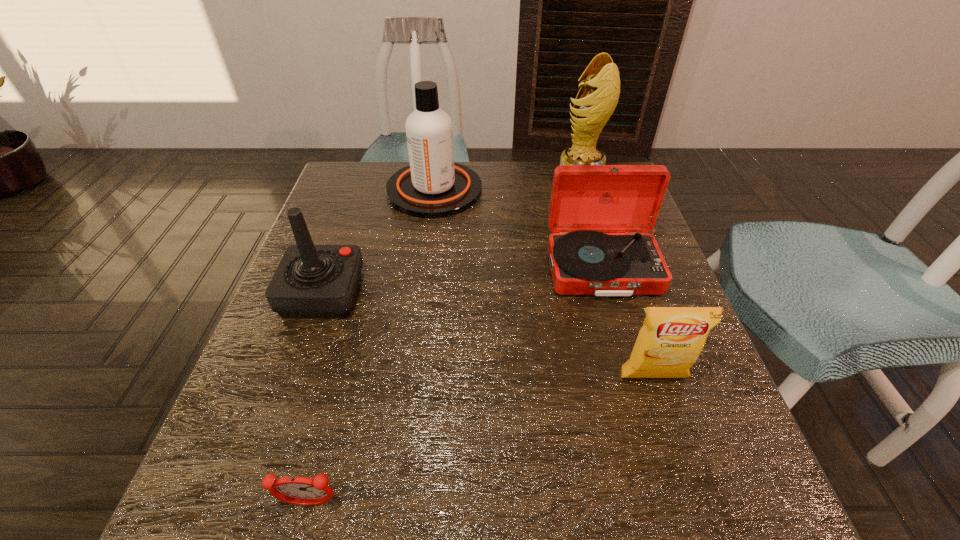
Locate an element on the screen. object identified as the third closest to the alarm clock is located at coordinates click(586, 200).